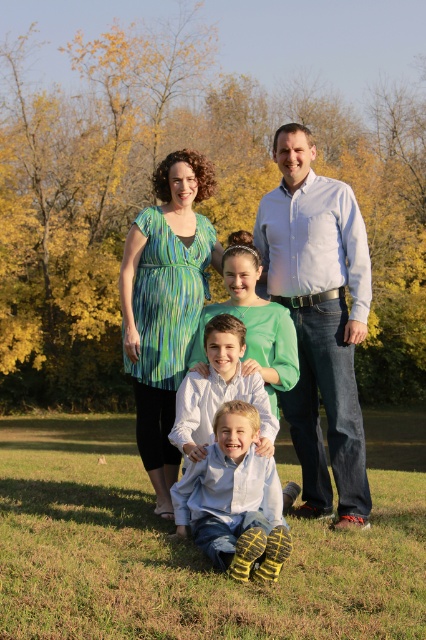
You are standing in the park where the family is posing. You want to take a photo of the point at coordinates point (311, 364) and point (222, 524). Which point is closer to you?

Point (311, 364) is further to the camera than point (222, 524), so the point closer to you is point (222, 524).

In the scene shown: You are taking a photo of the family and notice the green grass at lower center and the white shirt at upper center. Which object is closer to the camera?

The green grass at lower center is closer to the camera because it is in front of the white shirt at upper center.